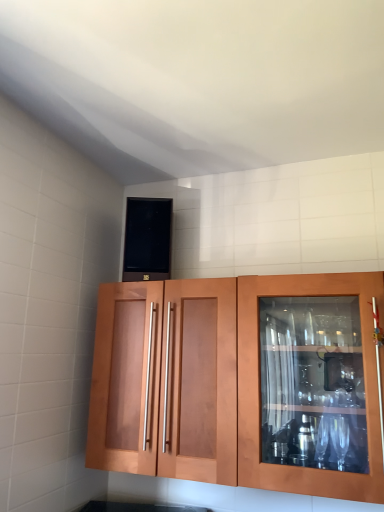
This screenshot has height=512, width=384. Find the location of `black matte speaker at upper center`. black matte speaker at upper center is located at coordinates (147, 239).

The image size is (384, 512). Describe the element at coordinates (147, 239) in the screenshot. I see `black matte speaker at upper center` at that location.

What do you see at coordinates (226, 381) in the screenshot? Image resolution: width=384 pixels, height=512 pixels. I see `matte wood cabinet at center` at bounding box center [226, 381].

What is the approximate width of matte wood cabinet at center?

13.84 inches.

Where is `matte wood cabinet at center`? This screenshot has width=384, height=512. matte wood cabinet at center is located at coordinates (226, 381).

Where is `black matte speaker at upper center`? The image size is (384, 512). black matte speaker at upper center is located at coordinates (147, 239).

Which is more to the left, black matte speaker at upper center or matte wood cabinet at center?

From the viewer's perspective, black matte speaker at upper center appears more on the left side.

Relative to matte wood cabinet at center, is black matte speaker at upper center in front or behind?

black matte speaker at upper center is positioned farther from the viewer than matte wood cabinet at center.

Considering the positions of points (157, 246) and (329, 353), is point (157, 246) farther from camera compared to point (329, 353)?

That is True.

From the image's perspective, which one is positioned lower, black matte speaker at upper center or matte wood cabinet at center?

matte wood cabinet at center appears lower in the image.

From a real-world perspective, does black matte speaker at upper center sit lower than matte wood cabinet at center?

Incorrect, from a real-world perspective, black matte speaker at upper center is higher than matte wood cabinet at center.

Which of these two, black matte speaker at upper center or matte wood cabinet at center, is thinner?

black matte speaker at upper center.

Which of these two, black matte speaker at upper center or matte wood cabinet at center, stands taller?

matte wood cabinet at center.

Who is bigger, black matte speaker at upper center or matte wood cabinet at center?

matte wood cabinet at center is bigger.

Can matte wood cabinet at center be found inside black matte speaker at upper center?

That's incorrect, matte wood cabinet at center is not inside black matte speaker at upper center.

Would you consider black matte speaker at upper center to be distant from matte wood cabinet at center?

They are positioned close to each other.

Is black matte speaker at upper center positioned with its back to matte wood cabinet at center?

black matte speaker at upper center is not turned away from matte wood cabinet at center.

What's the angular difference between black matte speaker at upper center and matte wood cabinet at center's facing directions?

black matte speaker at upper center and matte wood cabinet at center are facing 17.9 degrees away from each other.

The image size is (384, 512). What are the coordinates of `appliance above the matte wood cabinet at center (from the image's perspective)` in the screenshot? It's located at (147, 239).

Considering the relative positions of matte wood cabinet at center and black matte speaker at upper center in the image provided, is matte wood cabinet at center to the left of black matte speaker at upper center from the viewer's perspective?

Incorrect, matte wood cabinet at center is not on the left side of black matte speaker at upper center.

Which is in front, matte wood cabinet at center or black matte speaker at upper center?

matte wood cabinet at center is more forward.

Does point (142, 350) come farther from viewer compared to point (138, 276)?

No, (142, 350) is in front of (138, 276).

From the image's perspective, is matte wood cabinet at center located above black matte speaker at upper center?

Actually, matte wood cabinet at center appears below black matte speaker at upper center in the image.

From a real-world perspective, does matte wood cabinet at center sit lower than black matte speaker at upper center?

Yes, from a real-world perspective, matte wood cabinet at center is under black matte speaker at upper center.

Is matte wood cabinet at center wider or thinner than black matte speaker at upper center?

Clearly, matte wood cabinet at center has more width compared to black matte speaker at upper center.

In terms of height, does matte wood cabinet at center look taller or shorter compared to black matte speaker at upper center?

Clearly, matte wood cabinet at center is taller compared to black matte speaker at upper center.

Between matte wood cabinet at center and black matte speaker at upper center, which one has larger size?

matte wood cabinet at center is bigger.

Would you say matte wood cabinet at center is inside or outside black matte speaker at upper center?

matte wood cabinet at center is outside black matte speaker at upper center.

Is the surface of matte wood cabinet at center in direct contact with black matte speaker at upper center?

No, matte wood cabinet at center is not next to black matte speaker at upper center.

Does matte wood cabinet at center turn towards black matte speaker at upper center?

No, matte wood cabinet at center does not turn towards black matte speaker at upper center.

How different are the orientations of matte wood cabinet at center and black matte speaker at upper center in degrees?

17.9 degrees separate the facing orientations of matte wood cabinet at center and black matte speaker at upper center.

Identify the location of appliance that appears behind the matte wood cabinet at center. (147, 239).

Where is `appliance above the matte wood cabinet at center (from a real-world perspective)`? The width and height of the screenshot is (384, 512). appliance above the matte wood cabinet at center (from a real-world perspective) is located at coordinates (147, 239).

Where is `appliance behind the matte wood cabinet at center`? appliance behind the matte wood cabinet at center is located at coordinates (147, 239).